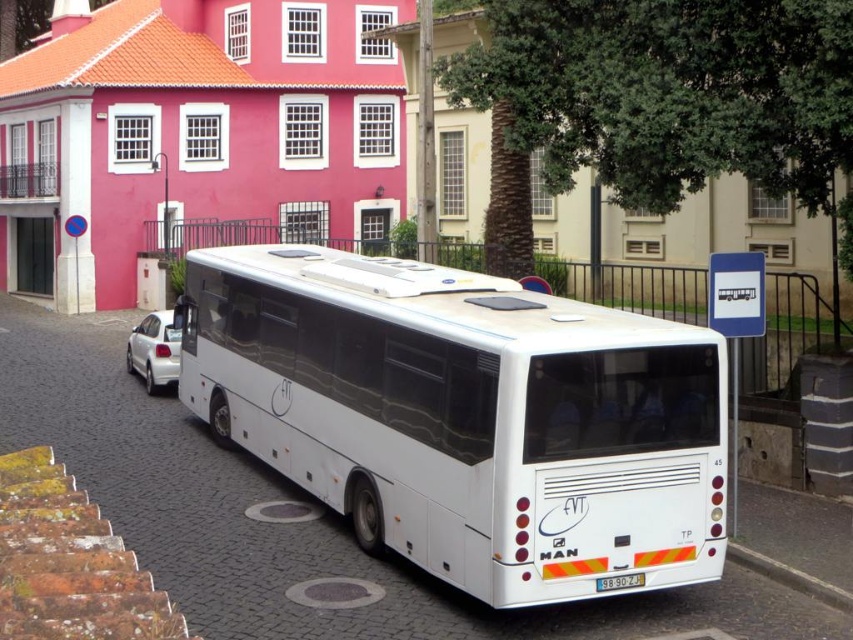
Consider the image. You are a delivery driver who needs to park your vehicle between the white matte bus at center and the gray concrete curb at lower right. Based on the scene, which side of the bus should you park on to ensure you are between both objects?

You should park to the right side of the white matte bus at center because it is positioned to the left of the gray concrete curb at lower right, so placing your vehicle on its right side will place you between both objects.

You are standing at the origin point of the image coordinate system. Where is the white matte bus at center located?

The white matte bus at center is located at point (466, 417).